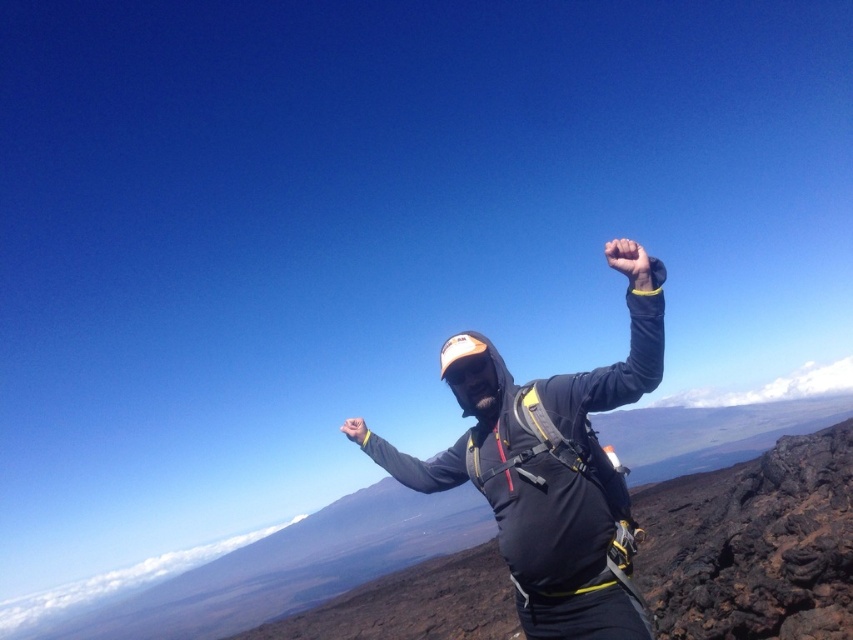
In the scene shown: Is black fabric jacket at center below black fleece arm at center?

Yes, black fabric jacket at center is below black fleece arm at center.

Can you confirm if black fabric jacket at center is positioned to the left of black fleece arm at center?

Yes, black fabric jacket at center is to the left of black fleece arm at center.

Who is more distant from viewer, (659, 604) or (407, 486)?

Point (659, 604)

Locate an element on the screen. The width and height of the screenshot is (853, 640). black fabric jacket at center is located at coordinates (334, 579).

Does point (447, 472) come farther from viewer compared to point (364, 436)?

No, it is in front of (364, 436).

Is black fleece arm at center taller than yellow fabric hand at center?

Incorrect, black fleece arm at center's height is not larger of yellow fabric hand at center's.

Is point (376, 444) closer to viewer compared to point (349, 420)?

No, (376, 444) is behind (349, 420).

I want to click on black fleece arm at center, so (x=410, y=460).

Does black fleece arm at center have a larger size compared to yellow matte hand at upper center?

Actually, black fleece arm at center might be smaller than yellow matte hand at upper center.

Does black fleece arm at center appear on the right side of yellow matte hand at upper center?

Incorrect, black fleece arm at center is not on the right side of yellow matte hand at upper center.

Between point (440, 456) and point (643, 269), which one is positioned in front?

Point (643, 269) is in front.

Find the location of a particular element. black fleece arm at center is located at coordinates (410, 460).